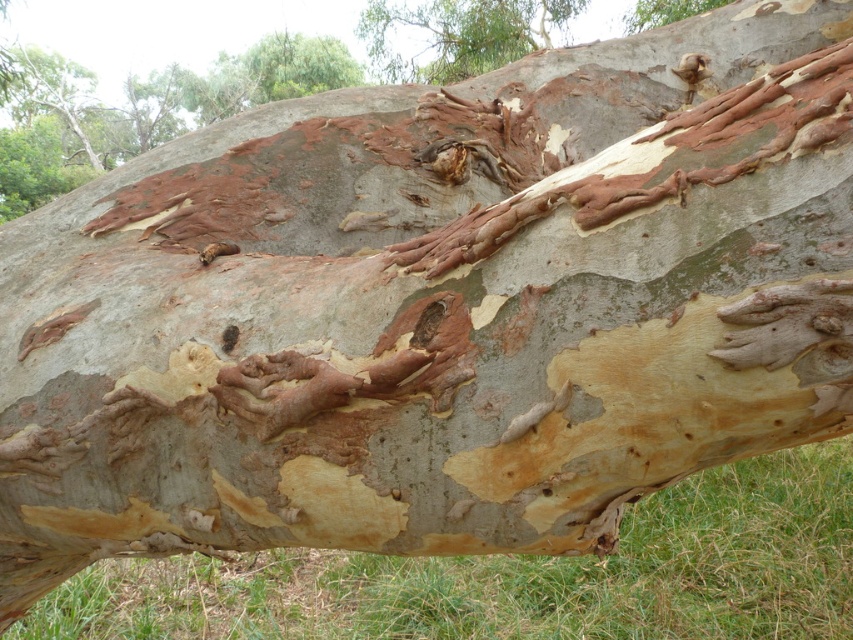
In order to click on smooth bark tree trunk at upper center in this screenshot , I will do `click(457, 35)`.

Is point (366, 45) farther from viewer compared to point (631, 19)?

Yes, it is.

Locate an element on the screen. This screenshot has height=640, width=853. smooth bark tree trunk at upper center is located at coordinates (457, 35).